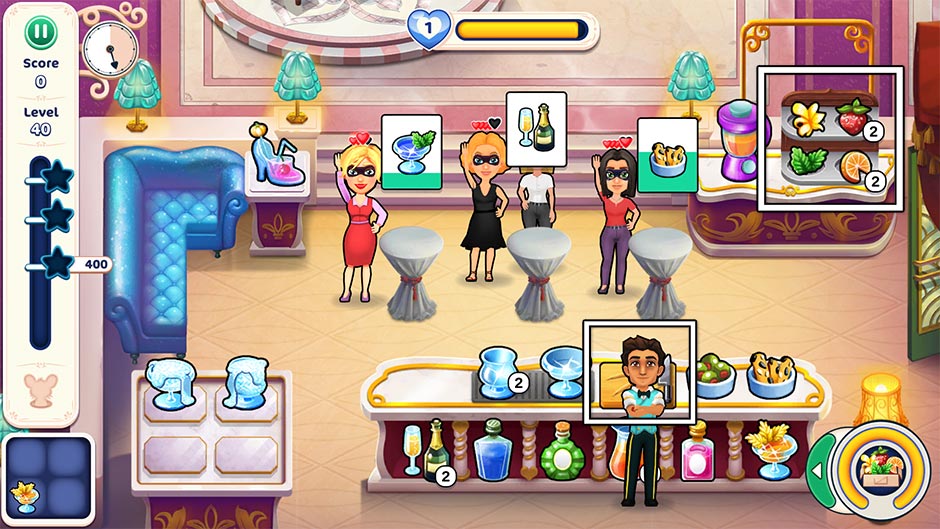
Find the location of a particular element. The height and width of the screenshot is (529, 940). white tables is located at coordinates (415, 250), (549, 251), (651, 242).